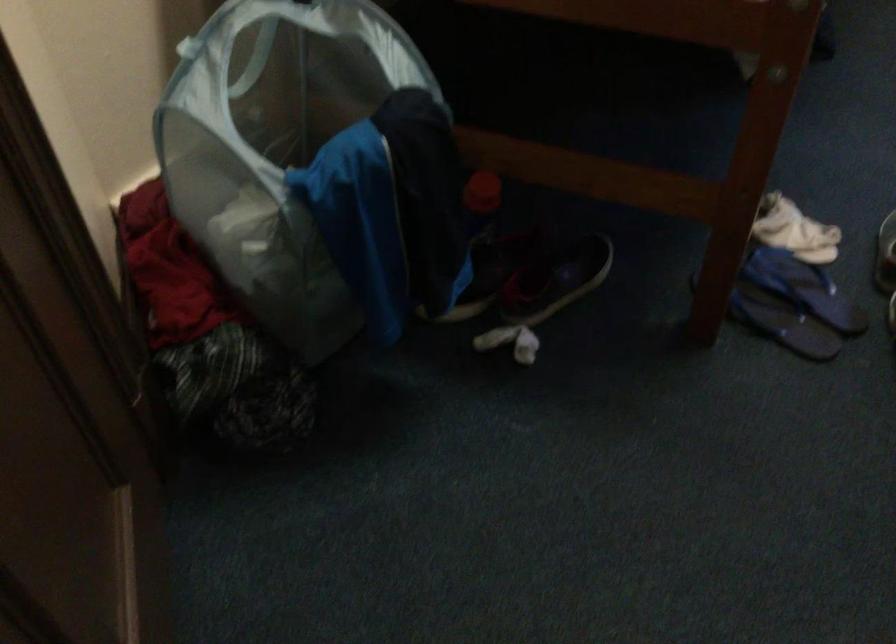
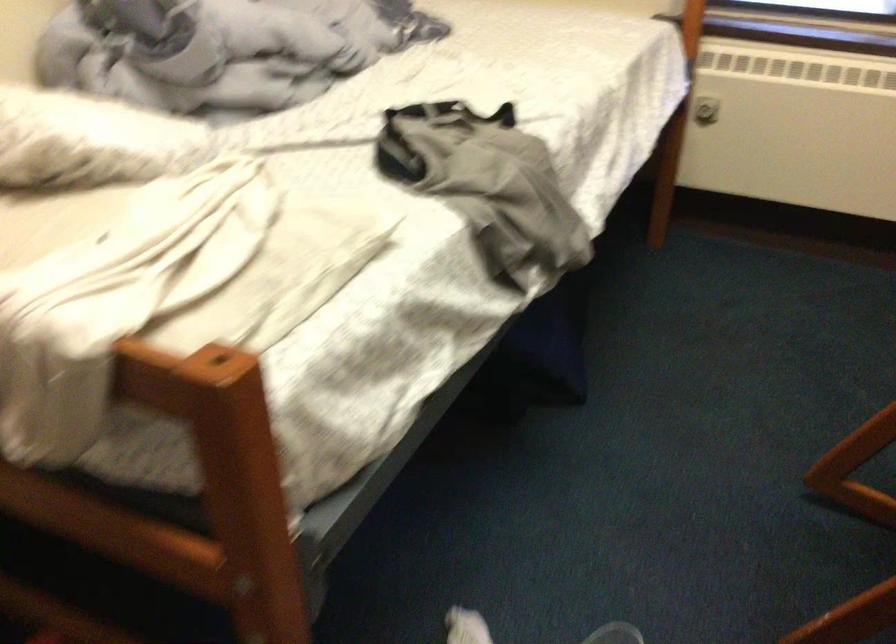
Question: Which direction would the cameraman need to move to produce the second image? Reply with the corresponding letter.

Choices:
 (A) Left
 (B) Right
 (C) Forward
 (D) Backward

Answer: (B)